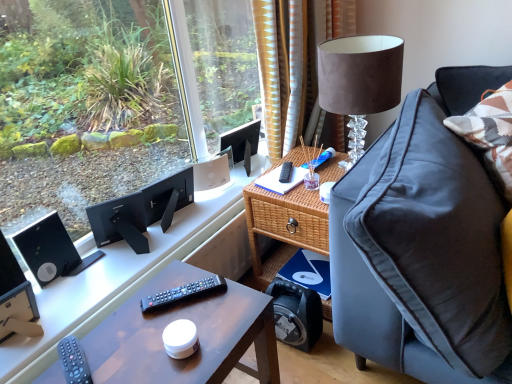
You are a GUI agent. You are given a task and a screenshot of the screen. Output one action in this format:
    pyautogui.click(x=<x>, y=<y>)
    Task: Click on the free spot to the right of black plastic speaker at lower left, which is counted as the first loudspeaker, starting from the front
    The image size is (512, 384).
    Given the screenshot: What is the action you would take?
    pyautogui.click(x=63, y=297)